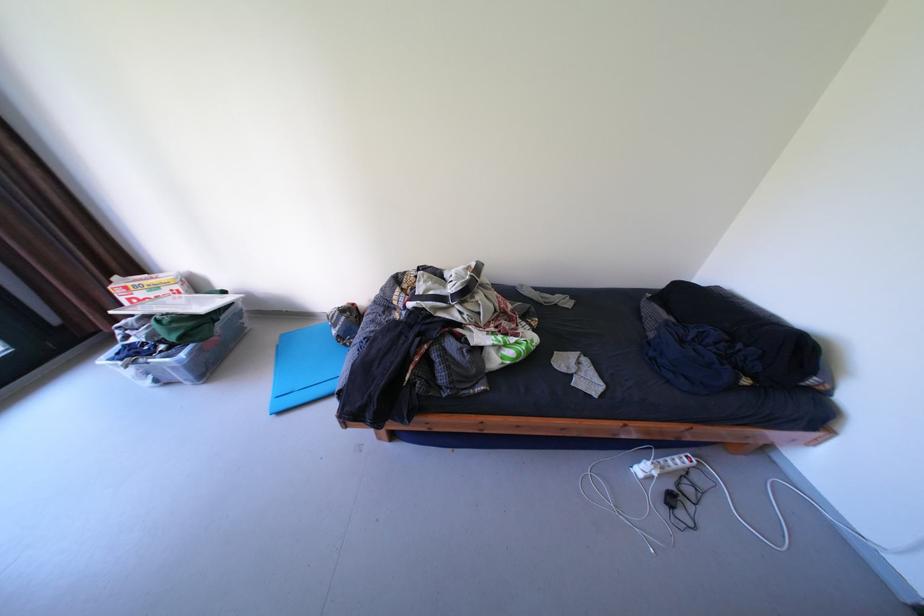
Find where to lift the white power strip. Please return your answer as a coordinate pair (x, y).

(663, 464)